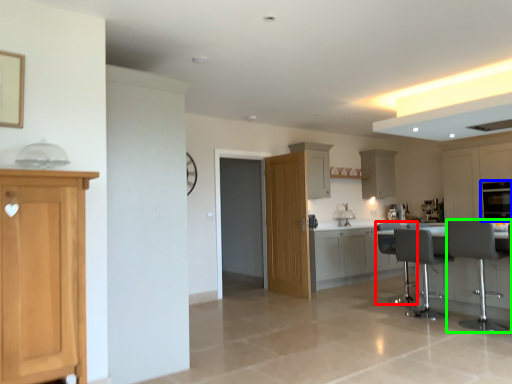
Question: Which is farther away from swivel chair (highlighted by a red box)? oven (highlighted by a blue box) or chair (highlighted by a green box)?

Choices:
 (A) oven
 (B) chair

Answer: (A)